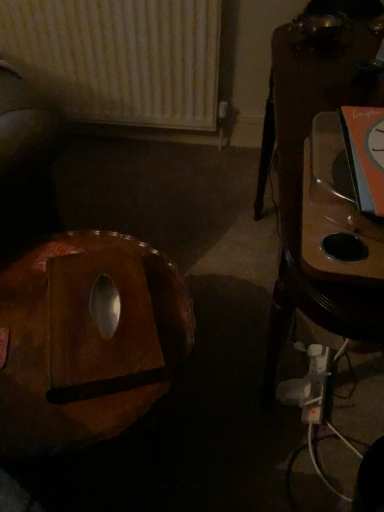
Question: Is brown leather bean bag chair at lower left to the left of wooden table at right from the viewer's perspective?

Choices:
 (A) no
 (B) yes

Answer: (B)

Question: Can you confirm if brown leather bean bag chair at lower left is shorter than wooden table at right?

Choices:
 (A) no
 (B) yes

Answer: (B)

Question: From the image's perspective, is brown leather bean bag chair at lower left over wooden table at right?

Choices:
 (A) no
 (B) yes

Answer: (A)

Question: Could wooden table at right be considered to be inside brown leather bean bag chair at lower left?

Choices:
 (A) yes
 (B) no

Answer: (B)

Question: Can you confirm if brown leather bean bag chair at lower left is wider than wooden table at right?

Choices:
 (A) yes
 (B) no

Answer: (A)

Question: From a real-world perspective, does brown leather bean bag chair at lower left stand above wooden table at right?

Choices:
 (A) no
 (B) yes

Answer: (A)

Question: Considering the relative sizes of white textured radiator at upper left and wooden table at right in the image provided, is white textured radiator at upper left taller than wooden table at right?

Choices:
 (A) no
 (B) yes

Answer: (A)

Question: Does white textured radiator at upper left lie in front of wooden table at right?

Choices:
 (A) yes
 (B) no

Answer: (B)

Question: From a real-world perspective, is white textured radiator at upper left on wooden table at right?

Choices:
 (A) yes
 (B) no

Answer: (A)

Question: Does white textured radiator at upper left have a lesser height compared to wooden table at right?

Choices:
 (A) no
 (B) yes

Answer: (B)

Question: Is white textured radiator at upper left with wooden table at right?

Choices:
 (A) yes
 (B) no

Answer: (B)

Question: From the image's perspective, would you say white textured radiator at upper left is shown under wooden table at right?

Choices:
 (A) yes
 (B) no

Answer: (B)

Question: Considering the relative sizes of wooden table at right and brown leather bean bag chair at lower left in the image provided, is wooden table at right wider than brown leather bean bag chair at lower left?

Choices:
 (A) yes
 (B) no

Answer: (B)